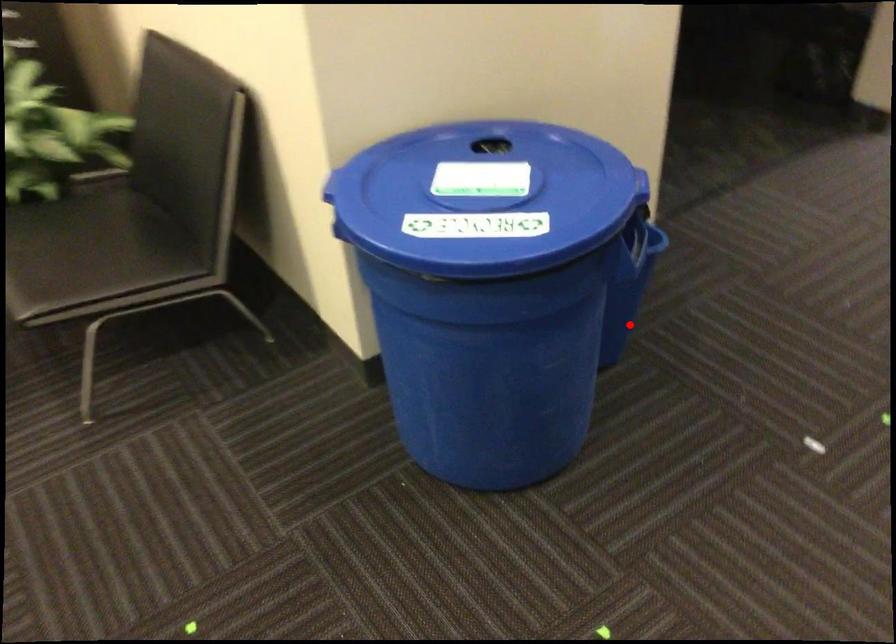
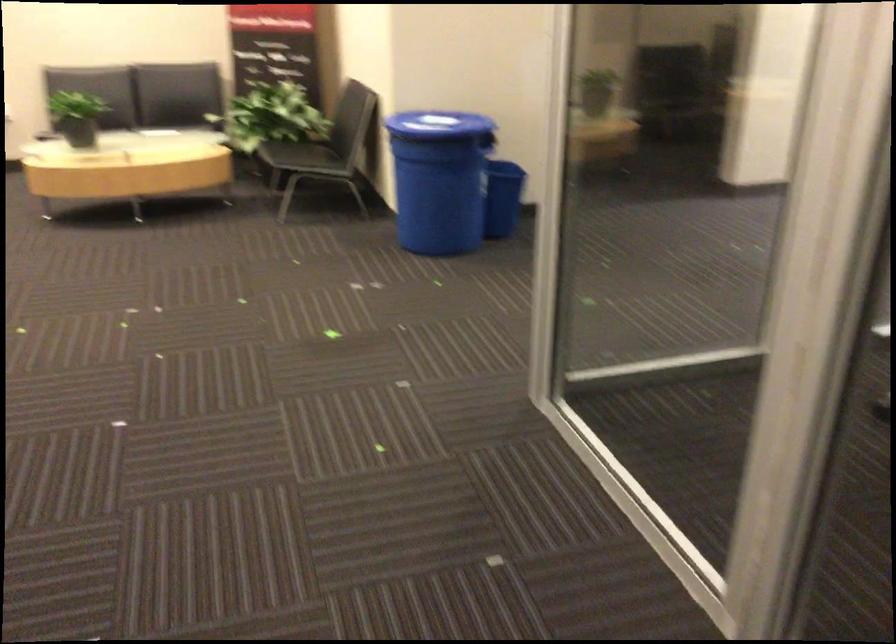
Find the pixel in the second image that matches the highlighted location in the first image.

(502, 198)